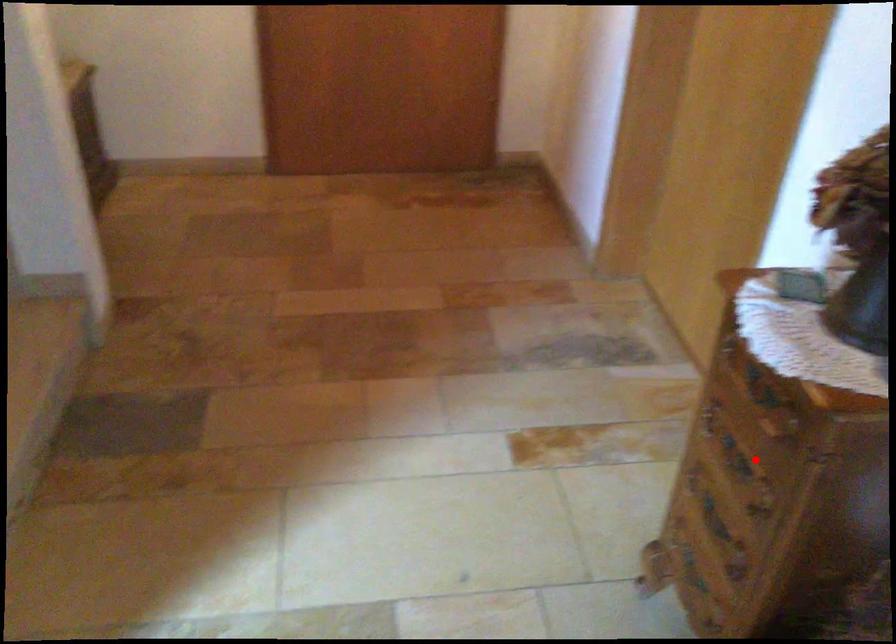
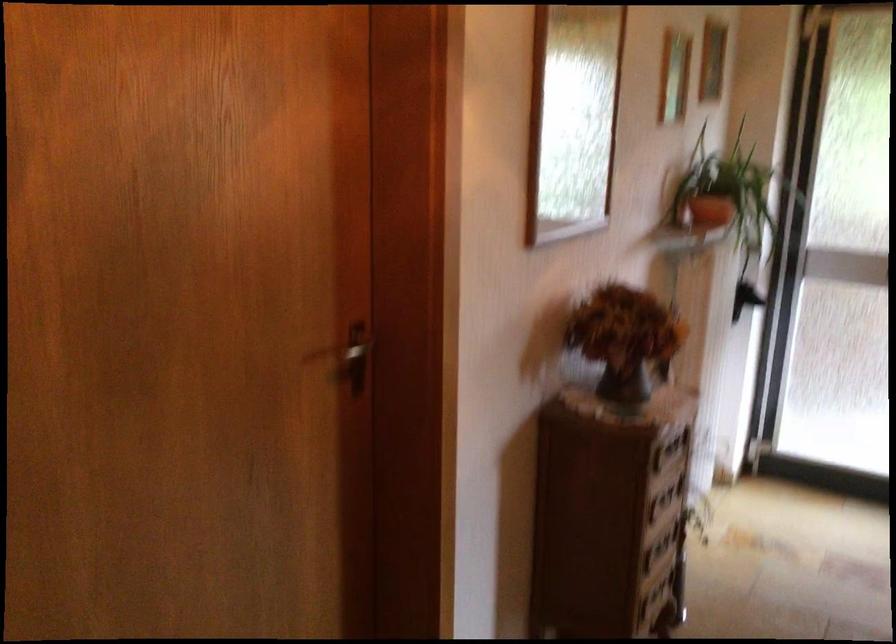
Question: I am providing you with two images of the same scene from different viewpoints. Given a red point in image1, look at the same physical point in image2. Is it:

Choices:
 (A) Closer to the viewpoint
 (B) Farther from the viewpoint

Answer: (B)